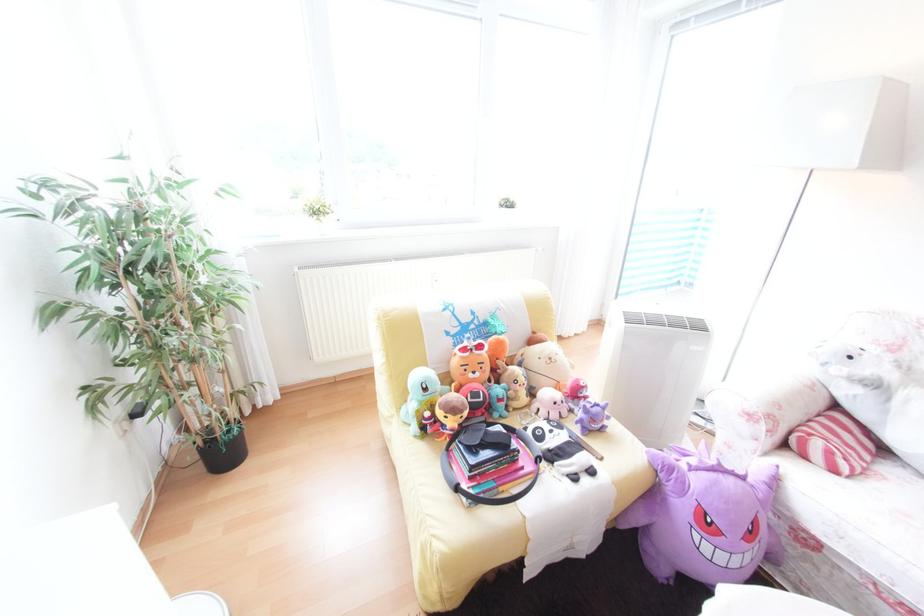
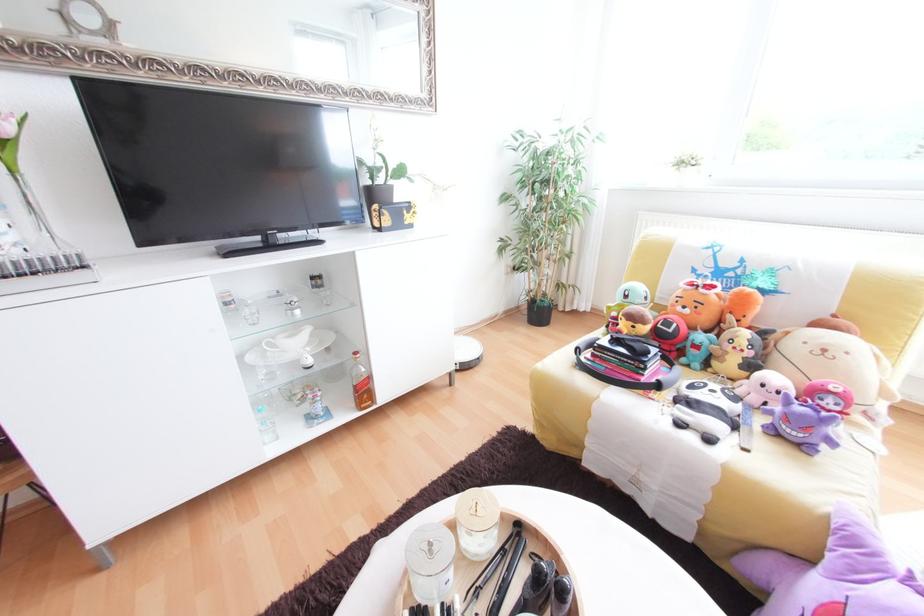
Question: The camera is either moving clockwise (left) or counter-clockwise (right) around the object. The first image is from the beginning of the video and the second image is from the end. Is the camera moving left or right when shooting the video?

Choices:
 (A) Left
 (B) Right

Answer: (B)